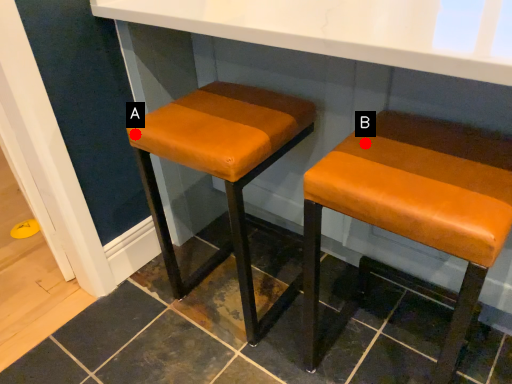
Question: Two points are circled on the image, labeled by A and B beside each circle. Which point is closer to the camera?

Choices:
 (A) A is closer
 (B) B is closer

Answer: (B)